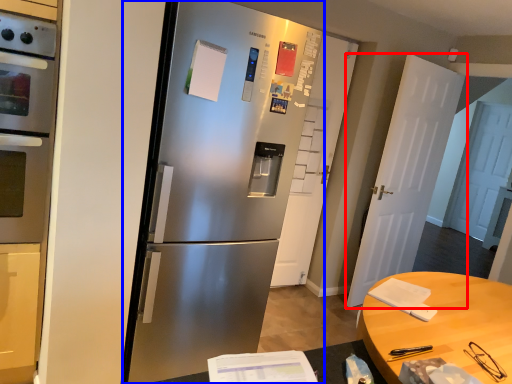
Question: Which of the following is the closest to the observer, door (highlighted by a red box) or refrigerator (highlighted by a blue box)?

Choices:
 (A) door
 (B) refrigerator

Answer: (B)